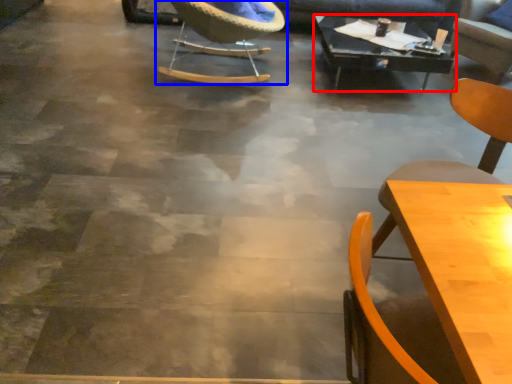
Question: Which object is further to the camera taking this photo, table (highlighted by a red box) or chair (highlighted by a blue box)?

Choices:
 (A) table
 (B) chair

Answer: (A)